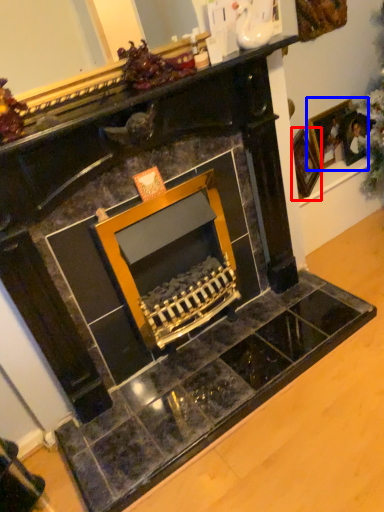
Question: Which object appears farthest to the camera in this image, picture frame (highlighted by a red box) or picture frame (highlighted by a blue box)?

Choices:
 (A) picture frame
 (B) picture frame

Answer: (B)